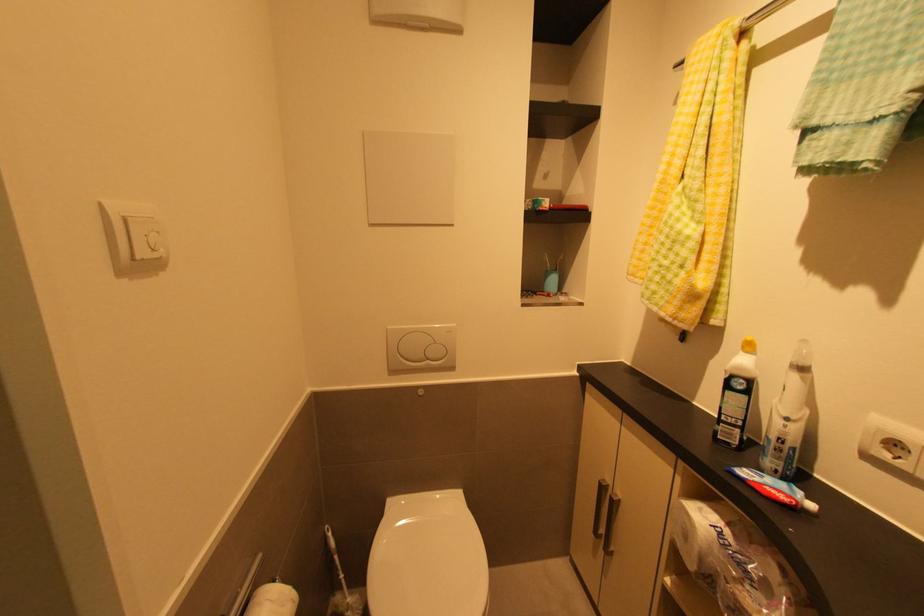
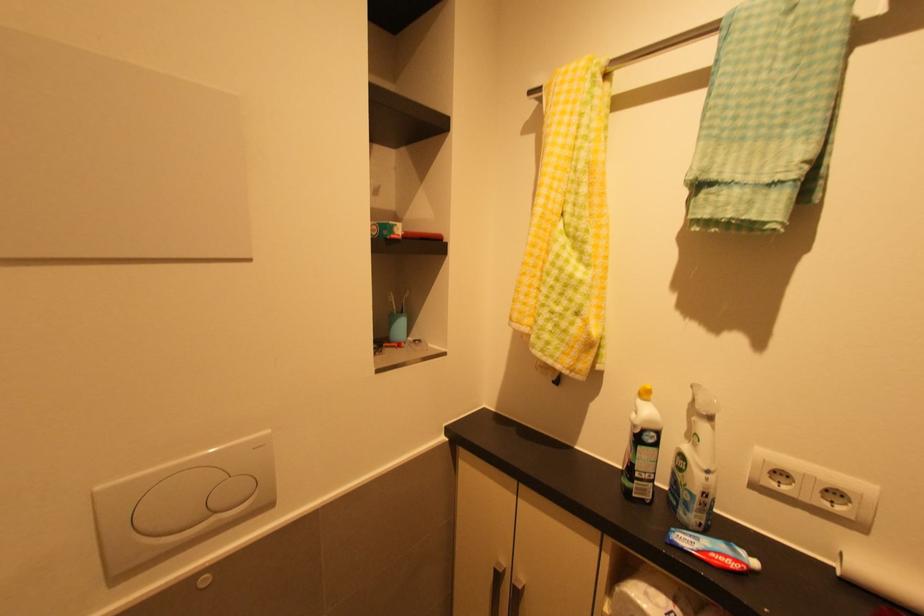
Question: The camera is either moving clockwise (left) or counter-clockwise (right) around the object. The first image is from the beginning of the video and the second image is from the end. Is the camera moving left or right when shooting the video?

Choices:
 (A) Left
 (B) Right

Answer: (A)